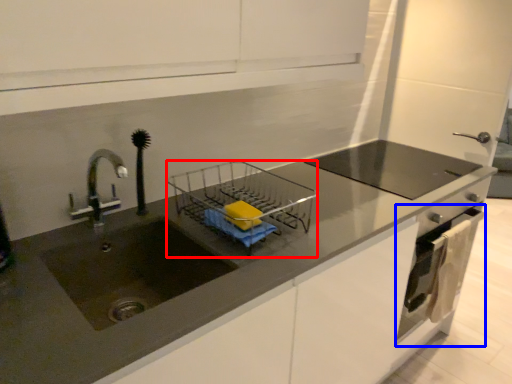
Question: Which object appears farthest to the camera in this image, appliance (highlighted by a red box) or oven (highlighted by a blue box)?

Choices:
 (A) appliance
 (B) oven

Answer: (B)